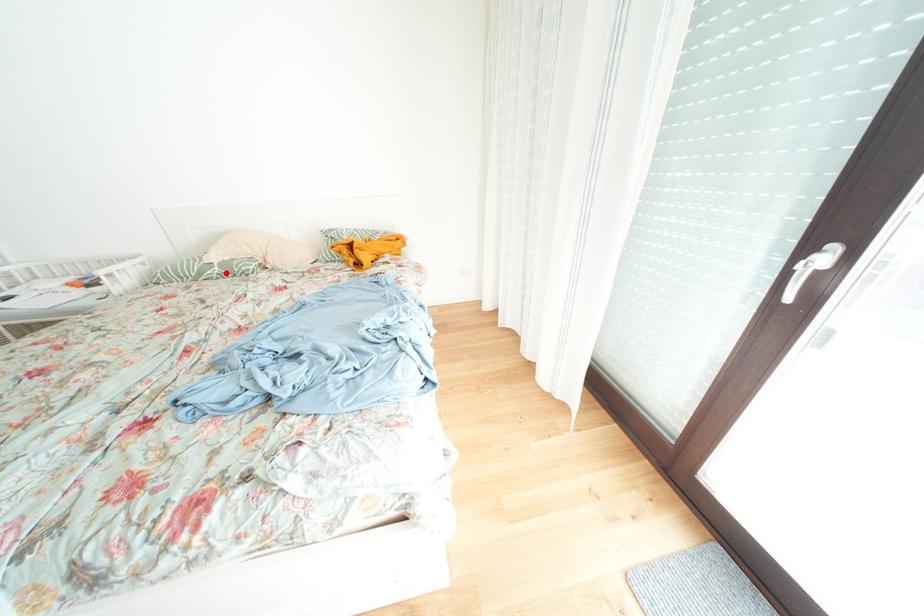
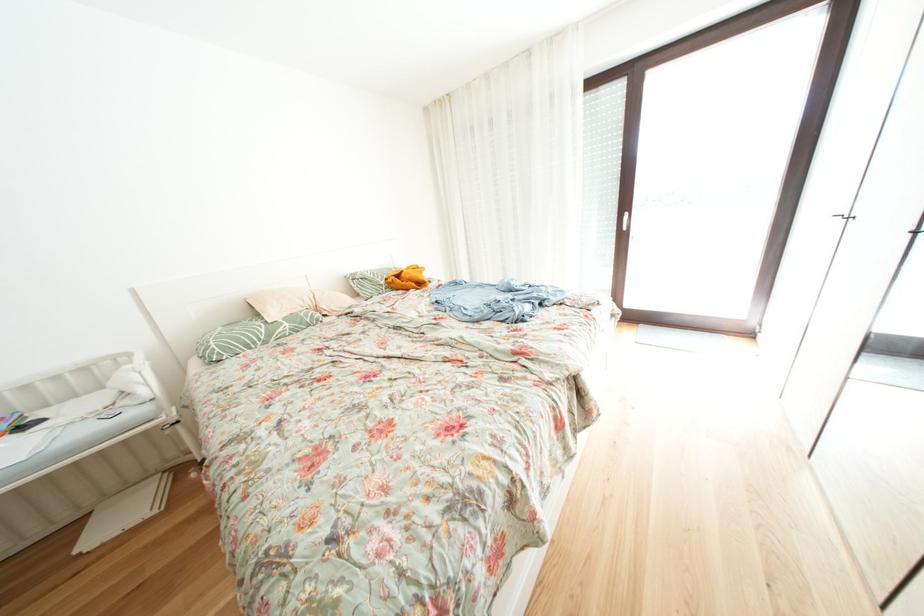
Find the pixel in the second image that matches the highlighted location in the first image.

(296, 329)